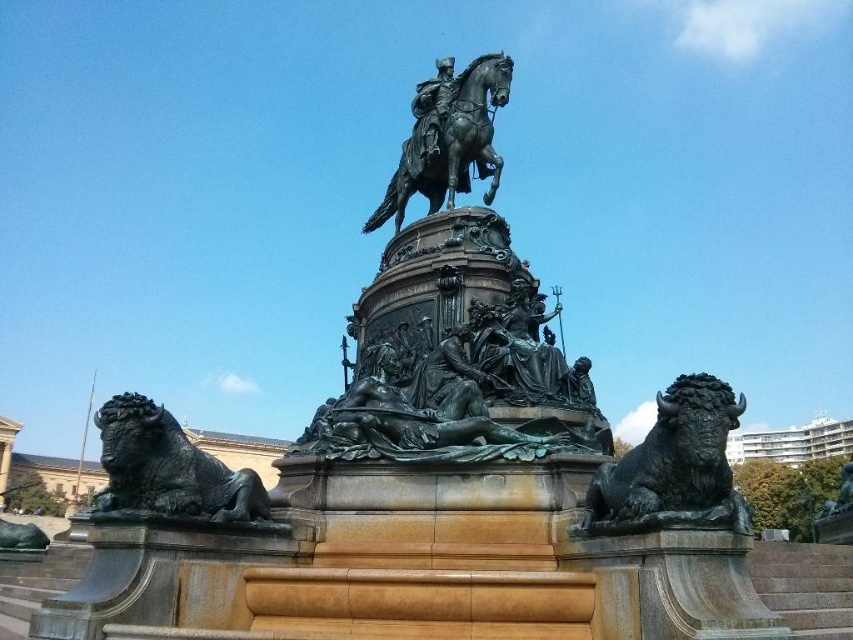
You are an art student analyzing the sculpture. You notice the bronze textured bison at lower right and the polished bronze statue at center. Which of these two has a greater height?

The polished bronze statue at center is taller than the bronze textured bison at lower right.